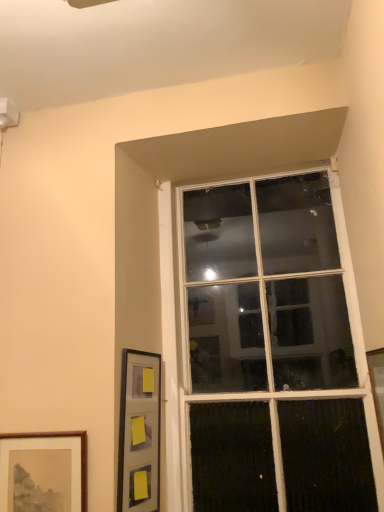
Question: Does matte black picture frame at lower left, the second picture frame positioned from the right, have a greater height compared to wooden picture frame at right, placed as the first picture frame when sorted from right to left?

Choices:
 (A) no
 (B) yes

Answer: (B)

Question: Is matte black picture frame at lower left, the second picture frame positioned from the right, closer to the viewer compared to wooden picture frame at right, placed as the first picture frame when sorted from right to left?

Choices:
 (A) no
 (B) yes

Answer: (A)

Question: From the image's perspective, would you say matte black picture frame at lower left, arranged as the 2th picture frame when viewed from the left, is positioned over wooden picture frame at right, placed as the first picture frame when sorted from right to left?

Choices:
 (A) no
 (B) yes

Answer: (A)

Question: Could you tell me if matte black picture frame at lower left, arranged as the 2th picture frame when viewed from the left, is facing wooden picture frame at right, which is the 3th picture frame in left-to-right order?

Choices:
 (A) yes
 (B) no

Answer: (A)

Question: Does matte black picture frame at lower left, arranged as the 2th picture frame when viewed from the left, have a larger size compared to wooden picture frame at right, placed as the first picture frame when sorted from right to left?

Choices:
 (A) no
 (B) yes

Answer: (B)

Question: From the image's perspective, is matte black picture frame at lower left, arranged as the 2th picture frame when viewed from the left, under wooden picture frame at right, placed as the first picture frame when sorted from right to left?

Choices:
 (A) no
 (B) yes

Answer: (B)

Question: Is clear glass window at upper center to the right of matte black picture frame at lower left, arranged as the 2th picture frame when viewed from the left, from the viewer's perspective?

Choices:
 (A) yes
 (B) no

Answer: (A)

Question: Is clear glass window at upper center completely or partially outside of matte black picture frame at lower left, the second picture frame positioned from the right?

Choices:
 (A) yes
 (B) no

Answer: (A)

Question: Is matte black picture frame at lower left, the second picture frame positioned from the right, a part of clear glass window at upper center?

Choices:
 (A) no
 (B) yes

Answer: (A)

Question: Can you confirm if clear glass window at upper center is positioned to the left of matte black picture frame at lower left, arranged as the 2th picture frame when viewed from the left?

Choices:
 (A) no
 (B) yes

Answer: (A)

Question: Does clear glass window at upper center lie in front of matte black picture frame at lower left, the second picture frame positioned from the right?

Choices:
 (A) no
 (B) yes

Answer: (A)

Question: Could you tell me if clear glass window at upper center is turned towards matte black picture frame at lower left, arranged as the 2th picture frame when viewed from the left?

Choices:
 (A) yes
 (B) no

Answer: (A)

Question: Is clear glass window at upper center oriented away from wooden picture frame at right, which is the 3th picture frame in left-to-right order?

Choices:
 (A) no
 (B) yes

Answer: (A)